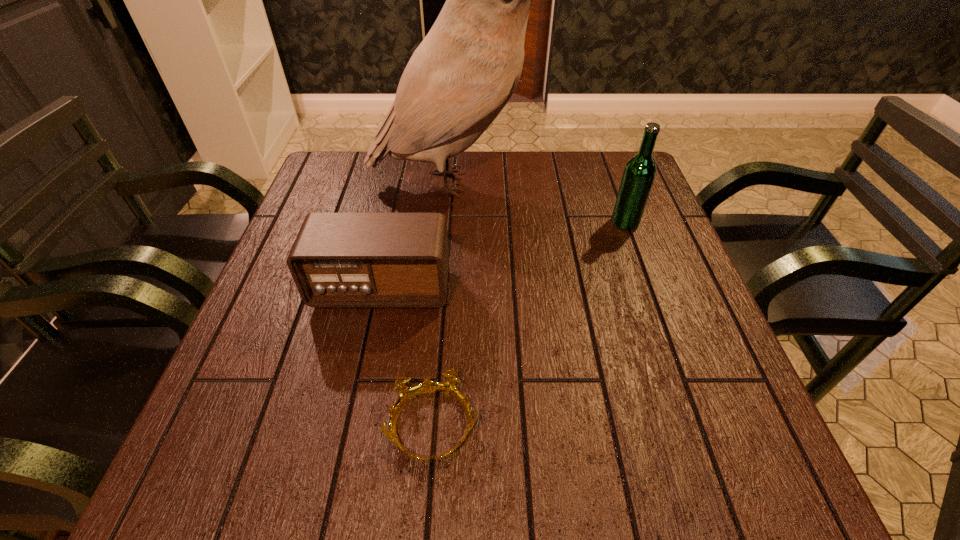
I want to click on free space at the right edge, so click(617, 239).

Image resolution: width=960 pixels, height=540 pixels. Find the location of `free spot at the far left corner of the desktop`. free spot at the far left corner of the desktop is located at coordinates pyautogui.click(x=334, y=150).

The width and height of the screenshot is (960, 540). In the image, there is a desktop. What are the coordinates of `vacant space at the near right corner` in the screenshot? It's located at (767, 469).

Find the location of a particular element. The width and height of the screenshot is (960, 540). vacant region between the crown and the second nearest object is located at coordinates (407, 357).

Locate an element on the screen. free space between the third shortest object and the parakeet is located at coordinates (540, 202).

Where is `vacant area that lies between the beer bottle and the tallest object`? The width and height of the screenshot is (960, 540). vacant area that lies between the beer bottle and the tallest object is located at coordinates (540, 202).

Locate an element on the screen. free spot between the nearest object and the second nearest object is located at coordinates (407, 357).

I want to click on free space between the second tallest object and the shortest object, so click(529, 324).

At what (x,y) coordinates should I click in order to perform the action: click on free area in between the nearest object and the third nearest object. Please return your answer as a coordinate pair (x, y). Looking at the image, I should click on (529, 324).

Identify the location of free space that is in between the radio receiver and the second tallest object. (503, 255).